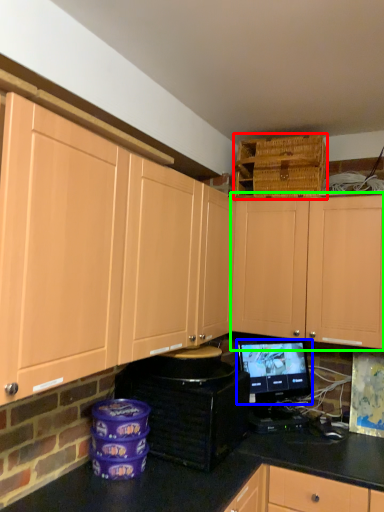
Question: Which object is positioned closest to basket (highlighted by a red box)? Select from computer monitor (highlighted by a blue box) and cabinetry (highlighted by a green box).

Choices:
 (A) computer monitor
 (B) cabinetry

Answer: (B)